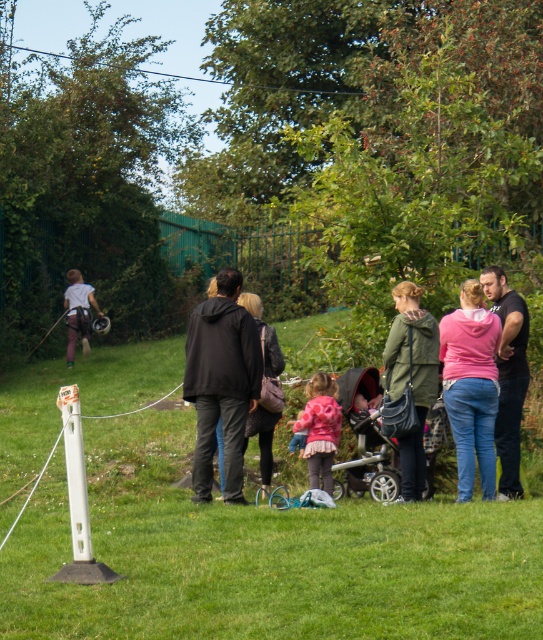
Which of these two, black matte jacket at center or pink fleece jacket at right, stands taller?

Standing taller between the two is black matte jacket at center.

Can you confirm if black matte jacket at center is bigger than pink fleece jacket at right?

Indeed, black matte jacket at center has a larger size compared to pink fleece jacket at right.

What are the coordinates of `black matte jacket at center` in the screenshot? It's located at (222, 381).

Between dark gray hoodie at center and silver metallic stroller at center, which one appears on the left side from the viewer's perspective?

silver metallic stroller at center is more to the left.

Who is more forward, (456, 420) or (365, 385)?

Point (456, 420) is more forward.

Find the location of a particular element. Image resolution: width=543 pixels, height=640 pixels. dark gray hoodie at center is located at coordinates (487, 400).

Consider the image. Can you confirm if silver metallic stroller at center is positioned to the right of light gray fabric backpack at left?

Indeed, silver metallic stroller at center is positioned on the right side of light gray fabric backpack at left.

Where is `silver metallic stroller at center`? silver metallic stroller at center is located at coordinates (365, 442).